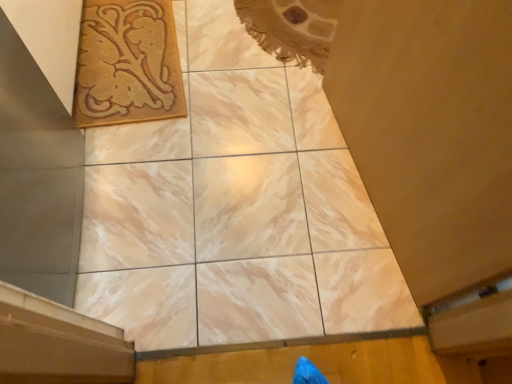
Identify the location of free space on the front side of marble tile at center. (214, 279).